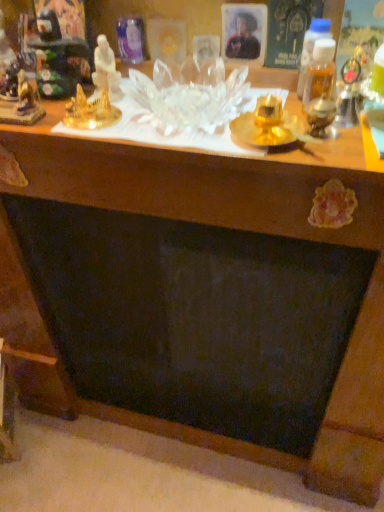
Where is `vacant point above transparent glass table at upper center (from a real-world perspective)`? vacant point above transparent glass table at upper center (from a real-world perspective) is located at coordinates (175, 121).